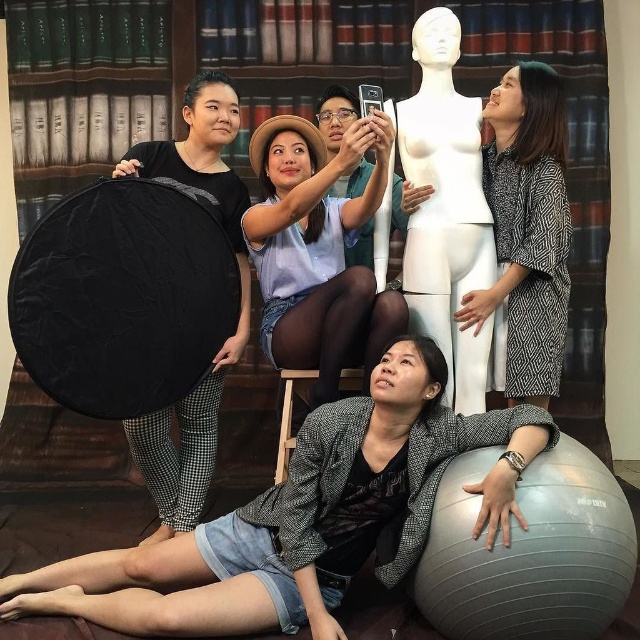
Does gray textured blazer at lower center have a larger size compared to white matte mannequin at center?

Correct, gray textured blazer at lower center is larger in size than white matte mannequin at center.

Between gray textured blazer at lower center and white matte mannequin at center, which one has more height?

With more height is white matte mannequin at center.

Which is behind, point (385, 508) or point (444, 92)?

The point (444, 92) is behind.

In order to click on gray textured blazer at lower center in this screenshot , I will do `click(305, 516)`.

Which is more to the left, gray textured blazer at lower center or patterned fabric kimono at right?

gray textured blazer at lower center

Between gray textured blazer at lower center and patterned fabric kimono at right, which one is positioned higher?

patterned fabric kimono at right is above.

Who is more forward, (12, 611) or (513, 284)?

Point (12, 611) is more forward.

I want to click on gray textured blazer at lower center, so (305, 516).

Who is positioned more to the left, matte blue shirt at upper center or patterned fabric kimono at right?

matte blue shirt at upper center is more to the left.

Does matte blue shirt at upper center have a greater height compared to patterned fabric kimono at right?

Incorrect, matte blue shirt at upper center's height is not larger of patterned fabric kimono at right's.

Who is more forward, (x=333, y=252) or (x=561, y=232)?

Positioned in front is point (x=561, y=232).

Image resolution: width=640 pixels, height=640 pixels. I want to click on matte blue shirt at upper center, so click(321, 256).